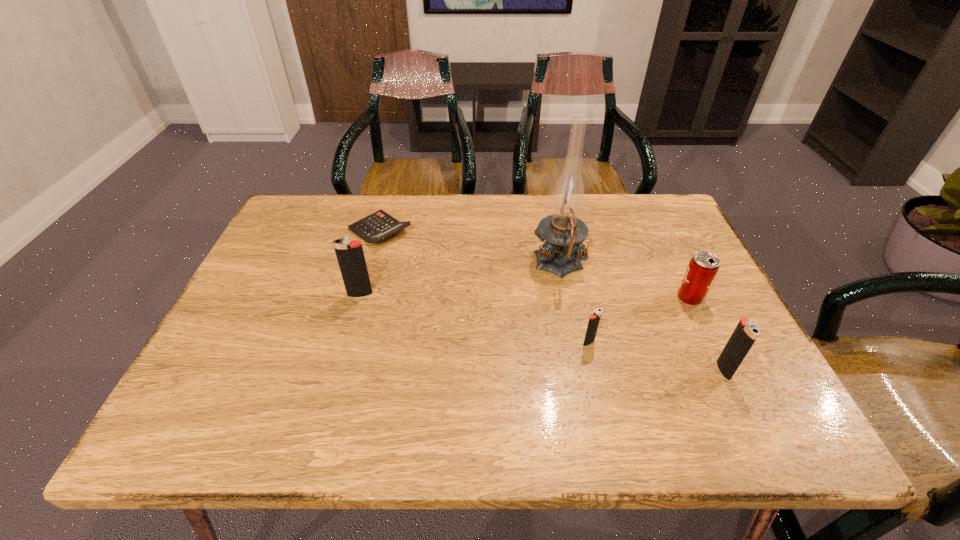
You are a GUI agent. You are given a task and a screenshot of the screen. Output one action in this format:
    pyautogui.click(x=<x>, y=<y>)
    Task: Click on the farthest igniter
    This screenshot has height=540, width=960.
    Given the screenshot: What is the action you would take?
    pyautogui.click(x=350, y=255)

Where is `the second farthest igniter`? This screenshot has width=960, height=540. the second farthest igniter is located at coordinates (594, 319).

The image size is (960, 540). Identify the location of the second nearest object. (594, 319).

This screenshot has height=540, width=960. I want to click on the second tallest igniter, so click(746, 332).

Where is `the rightmost igniter`? the rightmost igniter is located at coordinates (746, 332).

The width and height of the screenshot is (960, 540). Find the location of `the third shortest object`. the third shortest object is located at coordinates (702, 269).

Locate an element on the screen. The width and height of the screenshot is (960, 540). the shortest object is located at coordinates click(x=378, y=226).

You are a GUI agent. You are given a task and a screenshot of the screen. Output one action in this format:
    pyautogui.click(x=<x>, y=<y>)
    Task: Click on the oil lamp
    
    Given the screenshot: What is the action you would take?
    pyautogui.click(x=561, y=254)

I want to click on vacant space located on the left of the leftmost igniter, so click(307, 294).

At what (x,y) coordinates should I click in order to perform the action: click on vacant area situated 0.060m on the right of the fifth farthest object. Please return your answer as a coordinate pair (x, y). This screenshot has height=540, width=960. Looking at the image, I should click on (x=623, y=342).